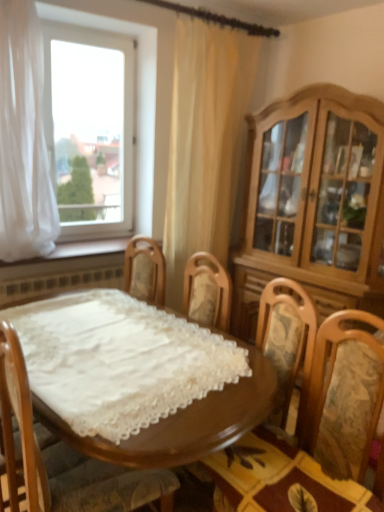
Question: Is point (230, 37) positioned closer to the camera than point (304, 160)?

Choices:
 (A) farther
 (B) closer

Answer: (A)

Question: From their relative heights in the image, would you say beige fabric curtain at upper center, arranged as the 2th curtain when viewed from the left, is taller or shorter than light brown wood cabinet at right?

Choices:
 (A) tall
 (B) short

Answer: (A)

Question: Which of these objects is positioned farthest from the wooden table at center?

Choices:
 (A) white sheer curtain at left, marked as the 1th curtain in a left-to-right arrangement
 (B) wooden chair with floral cushion at center
 (C) transparent glass window at upper left
 (D) wooden at lower left
 (E) beige fabric curtain at upper center, which ranks as the first curtain in right-to-left order

Answer: (C)

Question: Estimate the real-world distances between objects in this image. Which object is farther from the white sheer curtain at left, which appears as the 2th curtain when viewed from the right?

Choices:
 (A) wooden chair with floral cushion at center
 (B) wooden swivel chair at center
 (C) transparent glass window at upper left
 (D) wooden at lower left
 (E) wooden table at center

Answer: (B)